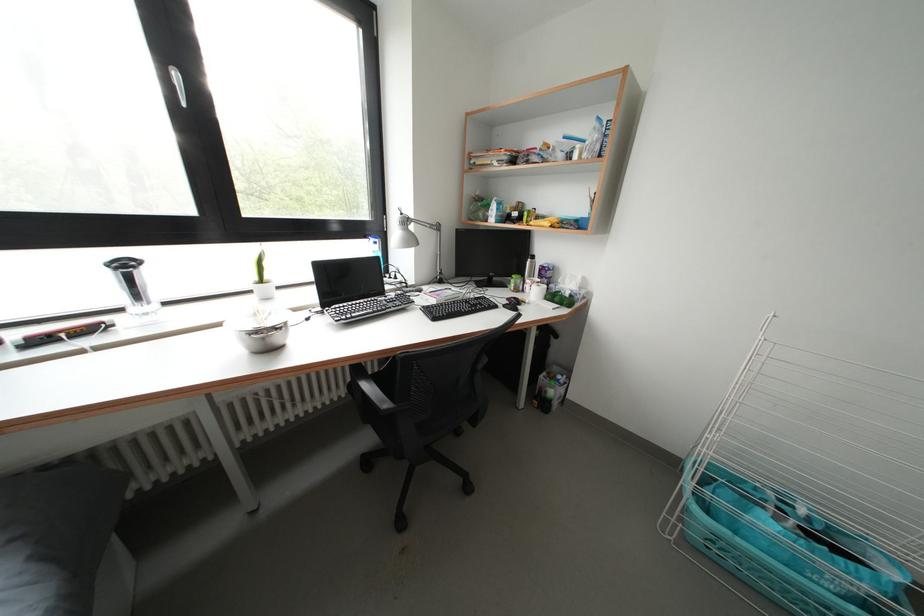
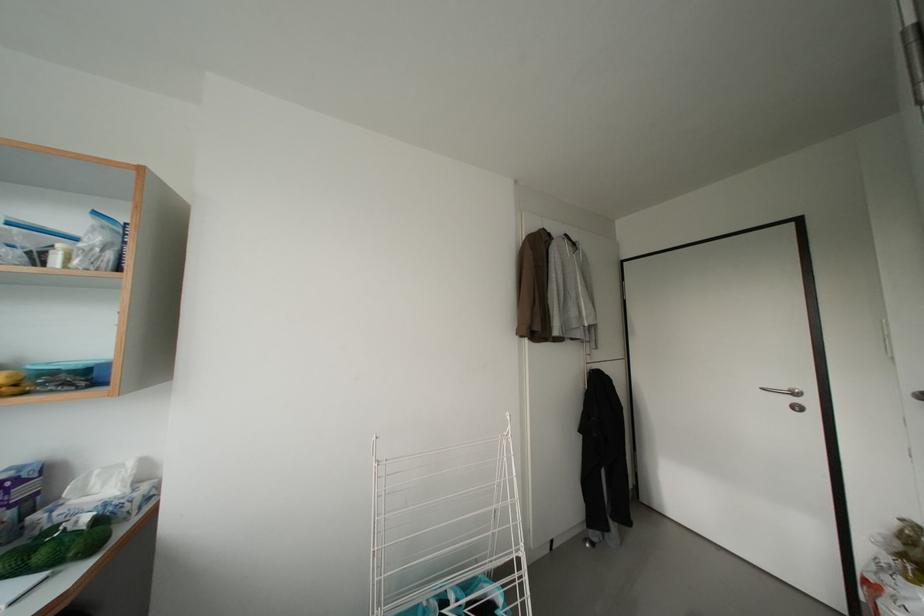
Find the pixel in the second image that matches (x=578, y=156) in the first image.

(51, 257)